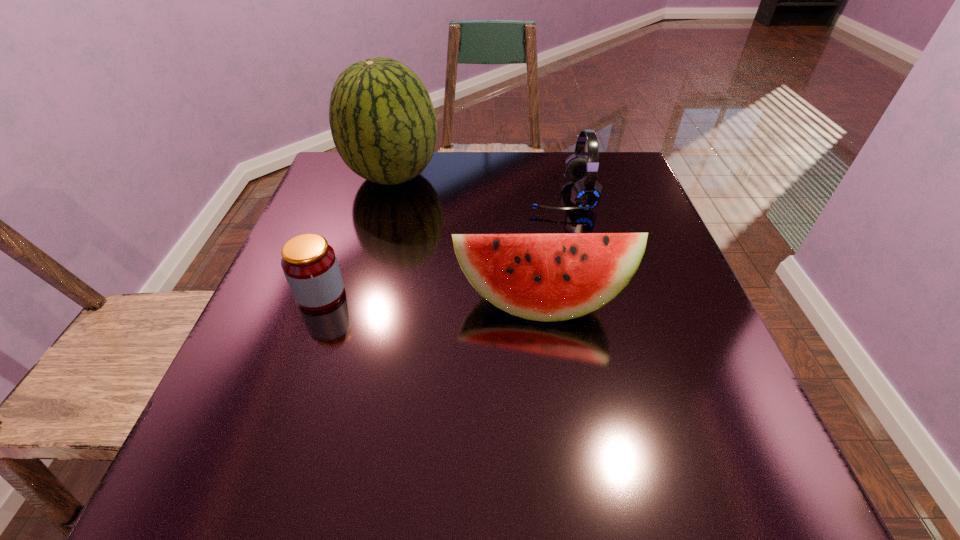
Identify the location of empty space between the shortest object and the right watermelon. (430, 298).

Locate which object ranks in proximity to the headset. Please provide its 2D coordinates. Your answer should be formatted as a tuple, i.e. [(x, y)], where the tuple contains the x and y coordinates of a point satisfying the conditions above.

[(544, 277)]

Where is `object that can be found as the closest to the nearer watermelon`? This screenshot has height=540, width=960. object that can be found as the closest to the nearer watermelon is located at coordinates (586, 193).

The image size is (960, 540). Find the location of `vacant position in the image that satisfies the following two spatial constraints: 1. on the ear cushions of the headset; 2. on the outer rind of the shorter watermelon`. vacant position in the image that satisfies the following two spatial constraints: 1. on the ear cushions of the headset; 2. on the outer rind of the shorter watermelon is located at coordinates (586, 301).